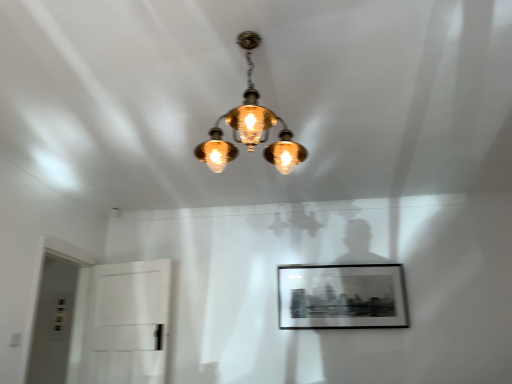
Question: From the image's perspective, would you say matte brass chandelier at center is shown under black matte picture frame at center?

Choices:
 (A) yes
 (B) no

Answer: (B)

Question: Is matte brass chandelier at center aimed at black matte picture frame at center?

Choices:
 (A) yes
 (B) no

Answer: (B)

Question: From a real-world perspective, is matte brass chandelier at center on black matte picture frame at center?

Choices:
 (A) no
 (B) yes

Answer: (B)

Question: Does matte brass chandelier at center have a greater height compared to black matte picture frame at center?

Choices:
 (A) no
 (B) yes

Answer: (B)

Question: Is matte brass chandelier at center not near black matte picture frame at center?

Choices:
 (A) yes
 (B) no

Answer: (A)

Question: Could black matte picture frame at center be considered to be inside matte brass chandelier at center?

Choices:
 (A) yes
 (B) no

Answer: (B)

Question: Is black matte picture frame at center not within white glossy door at left, which ranks as the first glass door in right-to-left order?

Choices:
 (A) no
 (B) yes

Answer: (B)

Question: Considering the relative positions of black matte picture frame at center and white glossy door at left, which ranks as the first glass door in right-to-left order, in the image provided, is black matte picture frame at center to the right of white glossy door at left, which ranks as the first glass door in right-to-left order, from the viewer's perspective?

Choices:
 (A) no
 (B) yes

Answer: (B)

Question: Are black matte picture frame at center and white glossy door at left, which ranks as the first glass door in right-to-left order, far apart?

Choices:
 (A) yes
 (B) no

Answer: (A)

Question: Is black matte picture frame at center wider than white glossy door at left, which ranks as the first glass door in right-to-left order?

Choices:
 (A) no
 (B) yes

Answer: (A)

Question: From the image's perspective, is black matte picture frame at center on white glossy door at left, which appears as the second glass door when viewed from the left?

Choices:
 (A) yes
 (B) no

Answer: (A)

Question: Can you confirm if black matte picture frame at center is thinner than white glossy door at left, which ranks as the first glass door in right-to-left order?

Choices:
 (A) yes
 (B) no

Answer: (A)

Question: Is matte brass chandelier at center to the left of transparent glass door at lower left, placed as the 2th glass door when sorted from right to left, from the viewer's perspective?

Choices:
 (A) yes
 (B) no

Answer: (B)